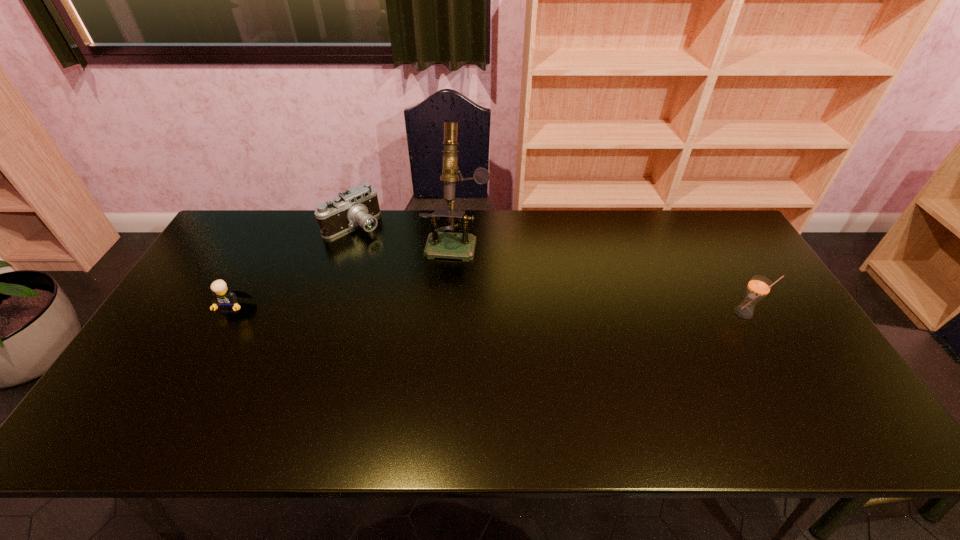
Image resolution: width=960 pixels, height=540 pixels. I want to click on the leftmost object, so [226, 299].

Locate an element on the screen. the second tallest object is located at coordinates (758, 287).

You are a GUI agent. You are given a task and a screenshot of the screen. Output one action in this format:
    pyautogui.click(x=<x>, y=<y>)
    Task: Click on the straw
    The width and height of the screenshot is (960, 540).
    Given the screenshot: What is the action you would take?
    pyautogui.click(x=758, y=287)

At what (x,y) coordinates should I click in order to perform the action: click on microscope. Please return your answer as a coordinate pair (x, y). The width and height of the screenshot is (960, 540). Looking at the image, I should click on (450, 245).

Locate an element on the screen. This screenshot has width=960, height=540. the third object from left to right is located at coordinates (450, 245).

Image resolution: width=960 pixels, height=540 pixels. What are the coordinates of `the third object from right to left` in the screenshot? It's located at (359, 205).

Locate an element on the screen. Image resolution: width=960 pixels, height=540 pixels. free space located on the front-facing side of the Lego is located at coordinates (207, 356).

I want to click on free space located 0.250m on the left of the third shortest object, so click(645, 313).

Where is `free point located 0.070m at the eyepiece of the microscope`? free point located 0.070m at the eyepiece of the microscope is located at coordinates (448, 276).

Locate an element on the screen. free spot located 0.090m at the eyepiece of the microscope is located at coordinates (447, 281).